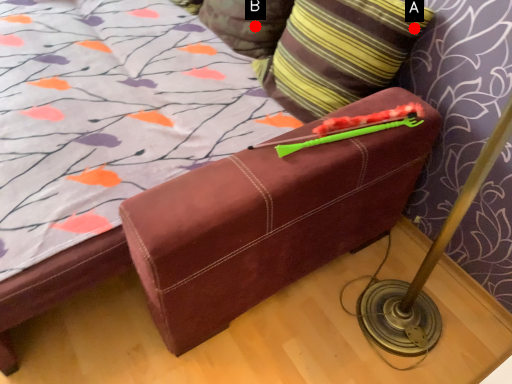
Question: Two points are circled on the image, labeled by A and B beside each circle. Which point is closer to the camera?

Choices:
 (A) A is closer
 (B) B is closer

Answer: (A)